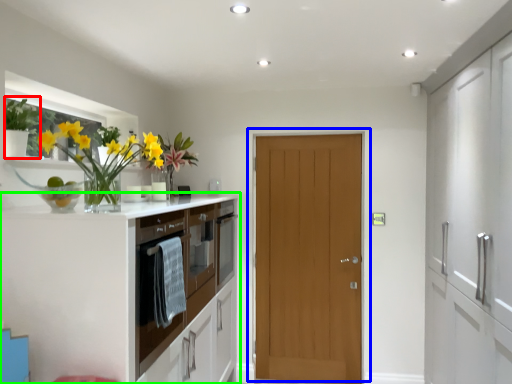
Question: Which is nearer to the plant (highlighted by a red box)? door (highlighted by a blue box) or cabinetry (highlighted by a green box).

Choices:
 (A) door
 (B) cabinetry

Answer: (B)